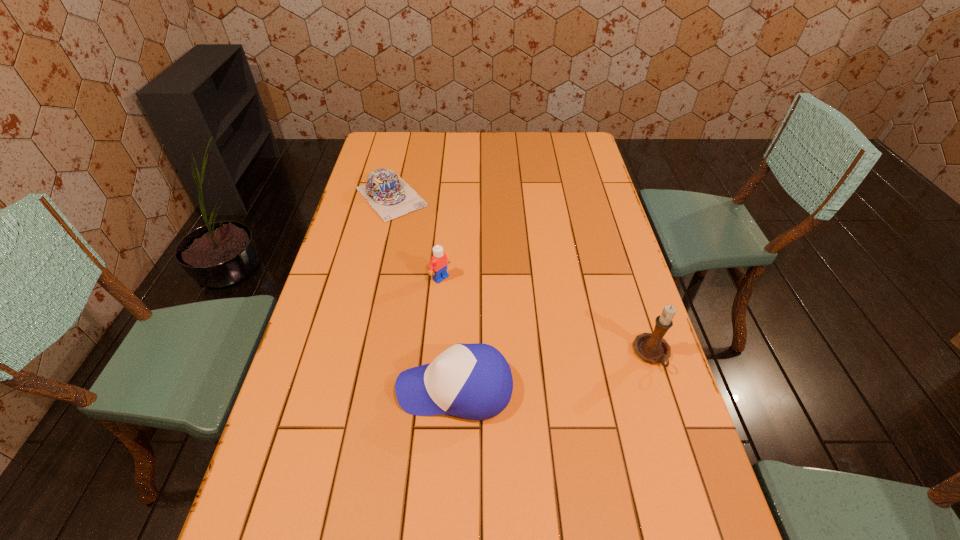
Find the location of a particular element. baseball cap is located at coordinates (474, 381).

Locate an element on the screen. The image size is (960, 540). candle holder is located at coordinates (652, 347).

The image size is (960, 540). I want to click on the tallest object, so click(x=652, y=347).

What are the coordinates of `Lego` in the screenshot? It's located at (438, 265).

Where is `the shortest object`? This screenshot has height=540, width=960. the shortest object is located at coordinates (389, 195).

The width and height of the screenshot is (960, 540). What are the coordinates of `the farthest object` in the screenshot? It's located at (389, 195).

This screenshot has width=960, height=540. Find the location of `free space located on the front-facing side of the baseball cap`. free space located on the front-facing side of the baseball cap is located at coordinates (299, 388).

You are a GUI agent. You are given a task and a screenshot of the screen. Output one action in this format:
    pyautogui.click(x=<x>, y=<y>)
    Task: Click on the vacant space located on the front-facing side of the baseball cap
    The height and width of the screenshot is (540, 960).
    Given the screenshot: What is the action you would take?
    pyautogui.click(x=294, y=388)

The image size is (960, 540). I want to click on vacant space located on the front-facing side of the baseball cap, so click(327, 388).

Identify the location of free spot located on the side of the candle holder with the handle. (708, 526).